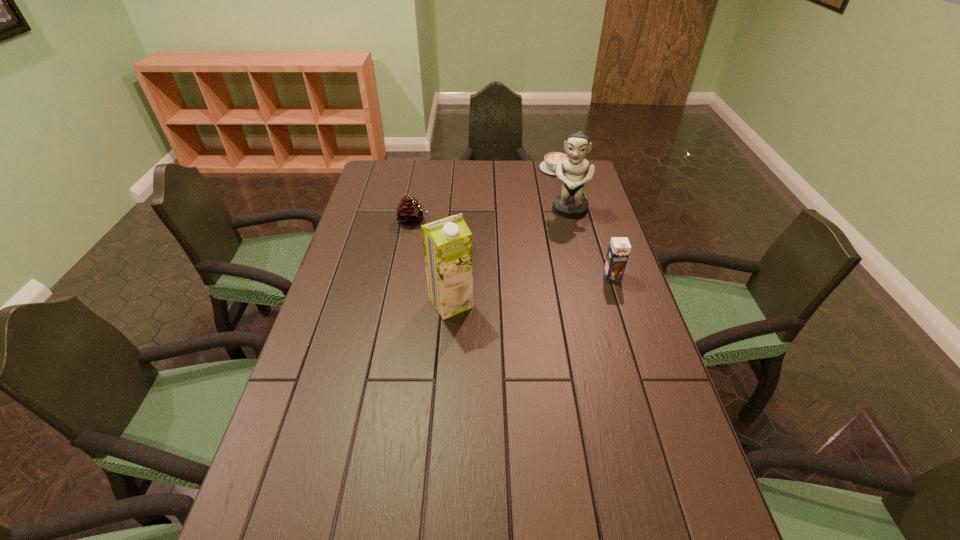
The image size is (960, 540). I want to click on unoccupied area between the chocolate milk and the leftmost object, so click(513, 248).

Where is `free space between the farthest object and the third shortest object`? free space between the farthest object and the third shortest object is located at coordinates (584, 222).

Select which object appears as the third closest to the chocolate milk. Please provide its 2D coordinates. Your answer should be formatted as a tuple, i.e. [(x, y)], where the tuple contains the x and y coordinates of a point satisfying the conditions above.

[(551, 159)]

Select which object is the fourth closest to the third tallest object. Please provide its 2D coordinates. Your answer should be formatted as a tuple, i.e. [(x, y)], where the tuple contains the x and y coordinates of a point satisfying the conditions above.

[(410, 212)]

You are a GUI agent. You are given a task and a screenshot of the screen. Output one action in this format:
    pyautogui.click(x=<x>, y=<y>)
    Task: Click on the free point that satisfies the following two spatial constraints: 1. on the back side of the figurine; 2. on the left side of the pinecone
    This screenshot has height=540, width=960.
    Given the screenshot: What is the action you would take?
    pyautogui.click(x=416, y=210)